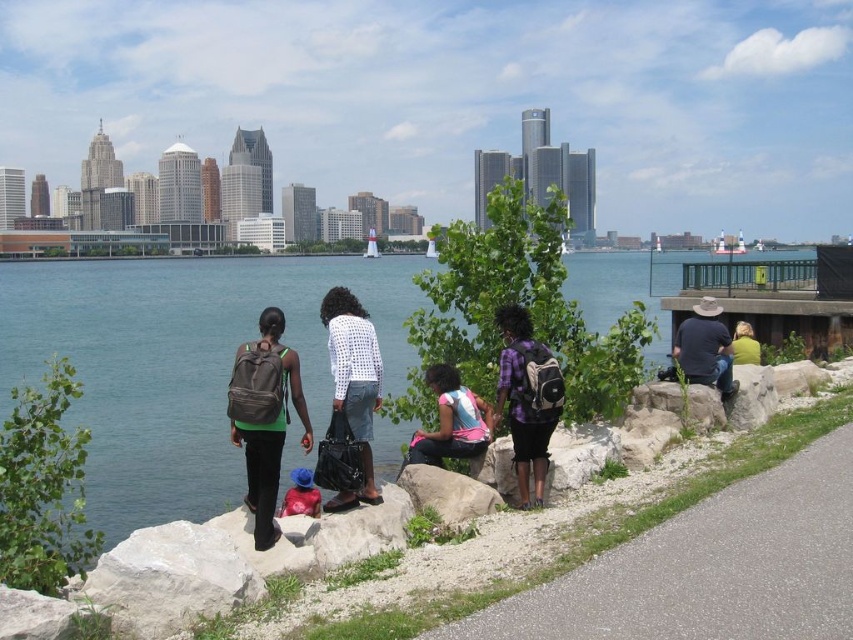
Question: Based on their relative distances, which object is farther from the blue denim jacket at lower center?

Choices:
 (A) yellow fabric at upper right
 (B) matte brown backpack at center-left
 (C) white dotted shirt at center

Answer: (A)

Question: Is white dotted shirt at center thinner than blue denim jacket at lower center?

Choices:
 (A) no
 (B) yes

Answer: (A)

Question: Is white dotted shirt at center below purple matte backpack at center?

Choices:
 (A) no
 (B) yes

Answer: (A)

Question: Can you confirm if clear blue water at center is positioned to the right of purple matte backpack at center?

Choices:
 (A) yes
 (B) no

Answer: (B)

Question: Which object is positioned closest to the light blue fabric backpack at center?

Choices:
 (A) gray rough rock at lower center
 (B) yellow fabric at upper right

Answer: (A)

Question: Which point is closer to the camera?

Choices:
 (A) (291, 515)
 (B) (712, 634)
 (C) (131, 285)
 (D) (502, 358)

Answer: (B)